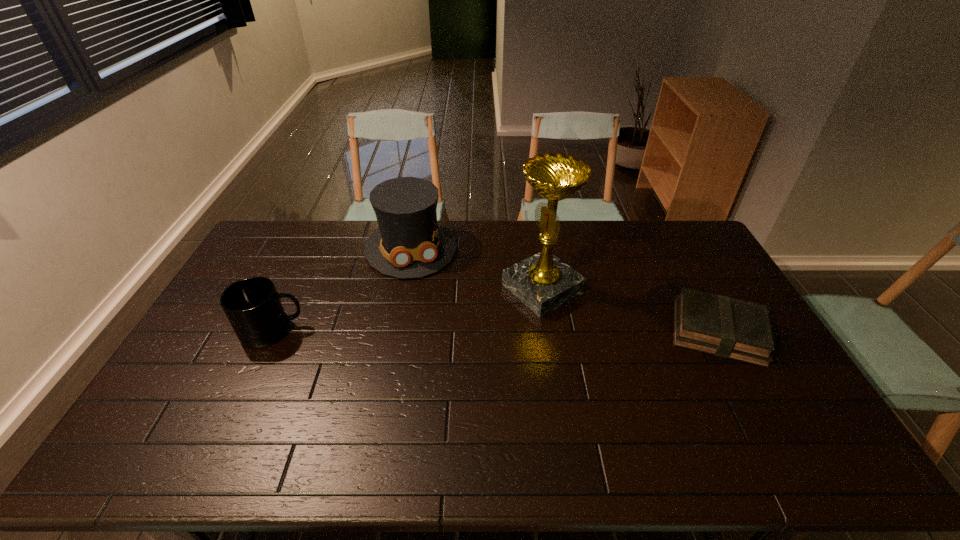
Locate an element on the screen. The width and height of the screenshot is (960, 540). vacant point located between the second tallest object and the tallest object is located at coordinates (x=477, y=268).

In order to click on vacant area that lies between the second object from right to left and the dress hat in this screenshot , I will do `click(477, 268)`.

At what (x,y) coordinates should I click in order to perform the action: click on free point between the dress hat and the leftmost object. Please return your answer as a coordinate pair (x, y). Looking at the image, I should click on pyautogui.click(x=342, y=289).

Identify the location of the third closest object to the rightmost object. The image size is (960, 540). (253, 307).

Identify which object is the second closest to the award. Please provide its 2D coordinates. Your answer should be formatted as a tuple, i.e. [(x, y)], where the tuple contains the x and y coordinates of a point satisfying the conditions above.

[(719, 325)]

Find the location of a particular element. The height and width of the screenshot is (540, 960). vacant space that satisfies the following two spatial constraints: 1. on the front side of the dress hat; 2. on the left side of the book is located at coordinates (395, 332).

What are the coordinates of `vacant point that satisfies the following two spatial constraints: 1. on the front side of the dress hat; 2. on the right side of the award` in the screenshot? It's located at (403, 288).